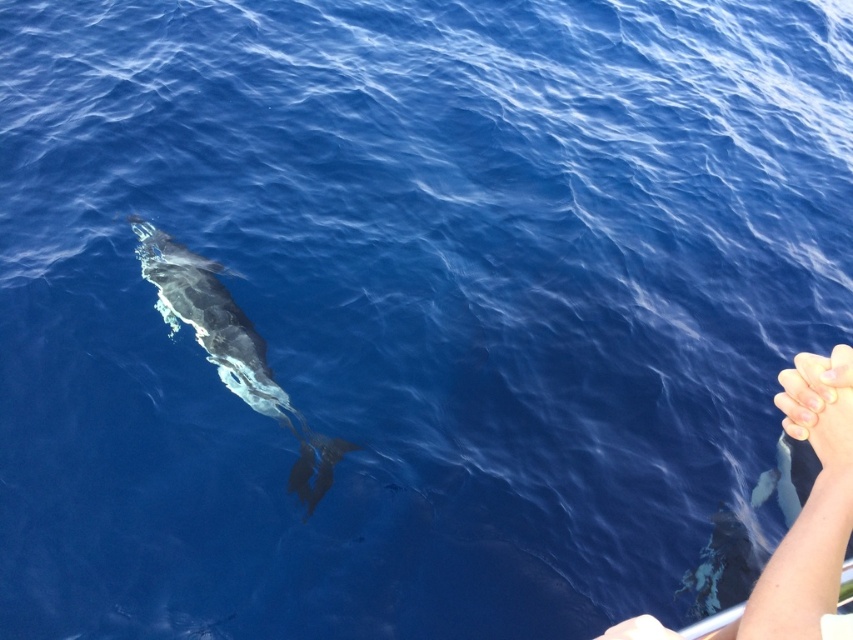
Question: Is skinny white arm at lower right to the left of gray smooth whale at center from the viewer's perspective?

Choices:
 (A) no
 (B) yes

Answer: (A)

Question: Which point appears closest to the camera in this image?

Choices:
 (A) (308, 477)
 (B) (840, 531)

Answer: (B)

Question: Is skinny white arm at lower right wider than gray smooth whale at center?

Choices:
 (A) no
 (B) yes

Answer: (A)

Question: Which point appears closest to the camera in this image?

Choices:
 (A) (207, 260)
 (B) (749, 609)

Answer: (B)

Question: Which object is farther from the camera taking this photo?

Choices:
 (A) skinny white arm at lower right
 (B) gray smooth whale at center

Answer: (B)

Question: Where is skinny white arm at lower right located in relation to gray smooth whale at center in the image?

Choices:
 (A) left
 (B) right

Answer: (B)